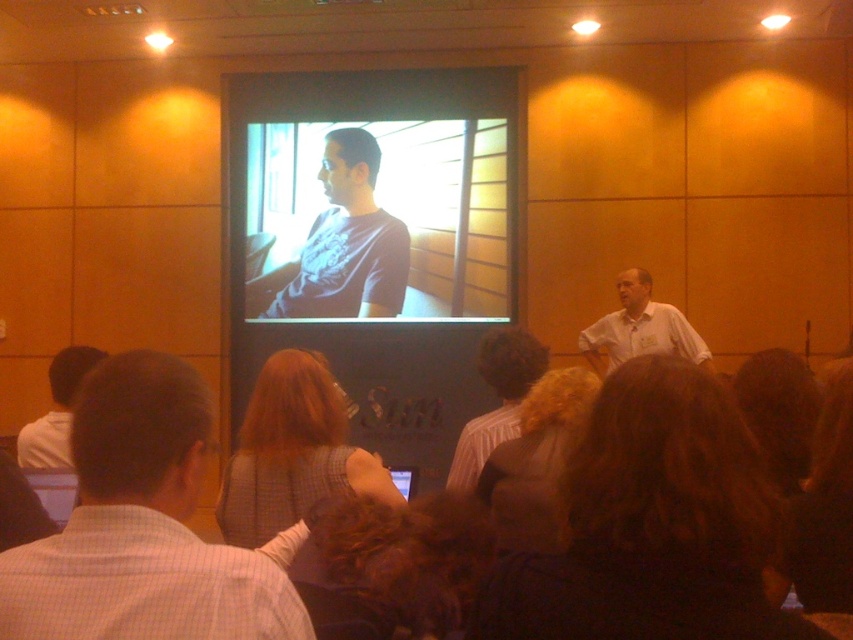
Question: Among these objects, which one is nearest to the camera?

Choices:
 (A) plaid fabric sleeve at center
 (B) striped shirt at center
 (C) purple matte shirt at upper center

Answer: (A)

Question: Is dark brown hair at lower center below white shirt at center?

Choices:
 (A) no
 (B) yes

Answer: (B)

Question: Which object is the farthest from the dark brown hair at lower center?

Choices:
 (A) white shirt at center
 (B) striped shirt at center
 (C) purple matte shirt at upper center
 (D) light brown shirt at lower left

Answer: (C)

Question: Estimate the real-world distances between objects in this image. Which object is farther from the plaid fabric sleeve at center?

Choices:
 (A) white shirt at center
 (B) purple matte shirt at upper center
 (C) striped shirt at center
 (D) dark brown hair at lower center

Answer: (B)

Question: Can you confirm if white checkered shirt at lower left is thinner than striped shirt at center?

Choices:
 (A) no
 (B) yes

Answer: (A)

Question: Does purple matte shirt at upper center appear over fuzzy brown hair at center?

Choices:
 (A) yes
 (B) no

Answer: (A)